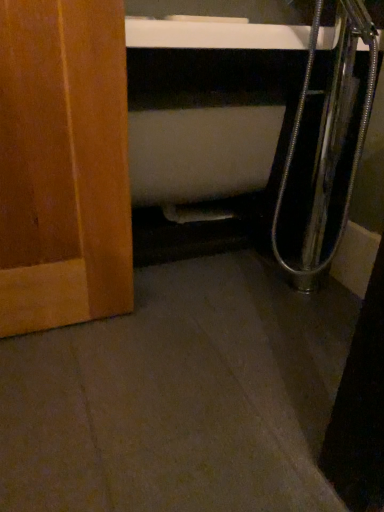
At what (x,y) coordinates should I click in order to perform the action: click on free space that is to the left of metallic silver showerhead at right. Please return your answer as a coordinate pair (x, y). Looking at the image, I should click on (239, 288).